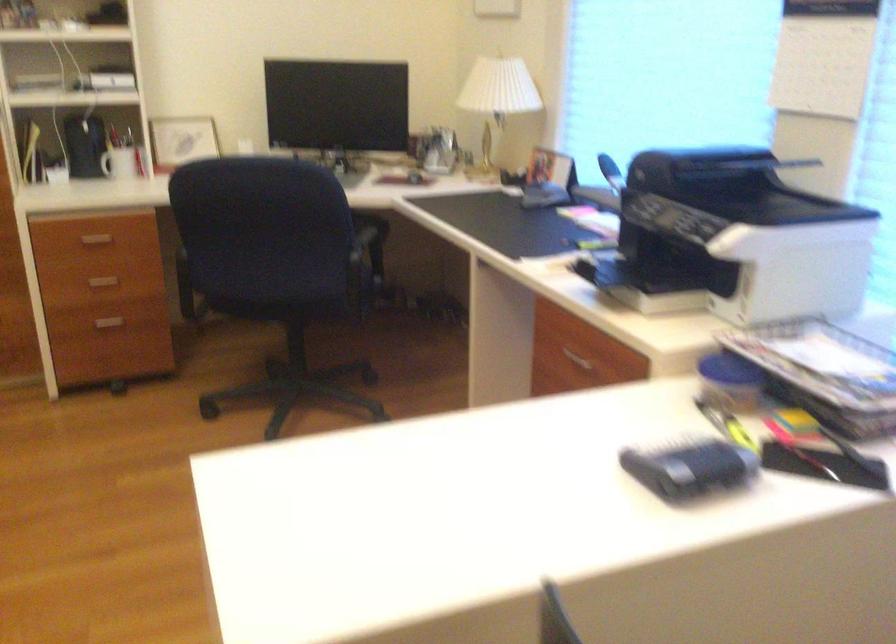
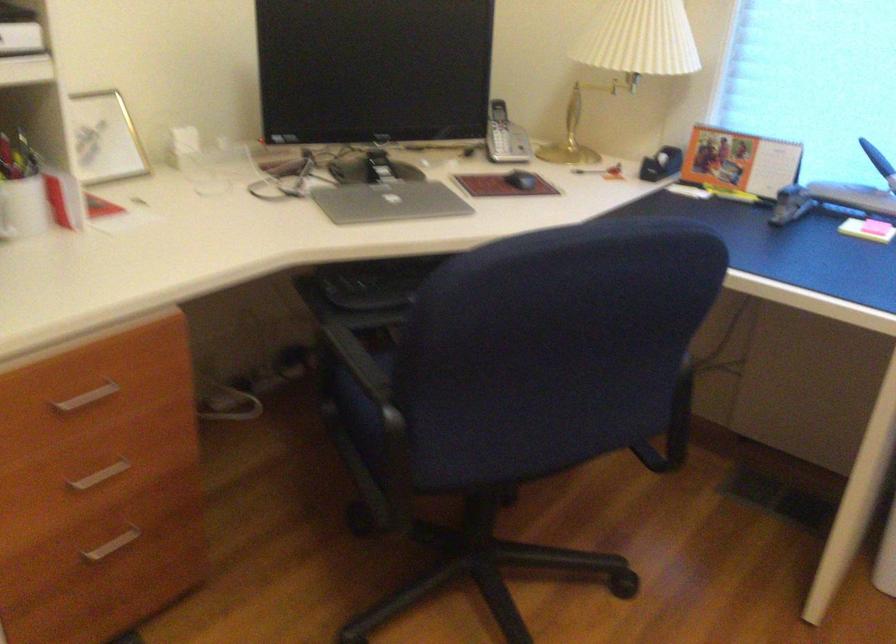
In the second image, find the point that corresponds to [432,149] in the first image.

(504, 136)